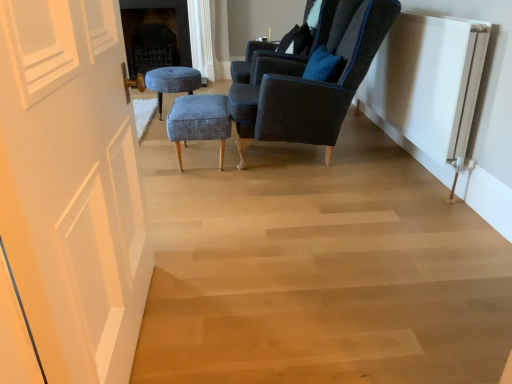
Locate an element on the screen. vacant space that's between velvet dark blue armchair at center, marked as the second chair in a back-to-front arrangement, and white ribbed radiator at right is located at coordinates (356, 182).